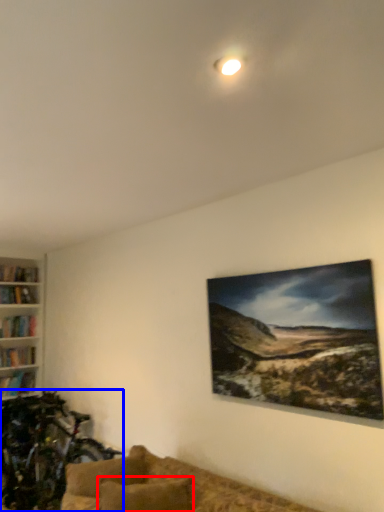
Question: Which of the following is the farthest to the observer, pillow (highlighted by a red box) or mountain bike (highlighted by a blue box)?

Choices:
 (A) pillow
 (B) mountain bike

Answer: (B)